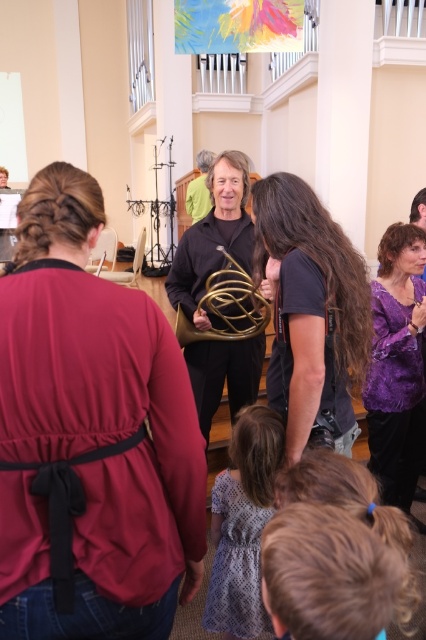
Based on the photo, who is shorter, matte red blouse at center or black t-shirt at center?

black t-shirt at center

The image size is (426, 640). Find the location of `matte red blouse at center`. matte red blouse at center is located at coordinates (91, 436).

Which is behind, point (72, 422) or point (290, 188)?

The point (290, 188) is behind.

Where is `matte red blouse at center`? The height and width of the screenshot is (640, 426). matte red blouse at center is located at coordinates (91, 436).

Is point (354, 426) positioned after point (250, 308)?

No.

Locate an element on the screen. The width and height of the screenshot is (426, 640). black t-shirt at center is located at coordinates (311, 310).

Is point (264, 200) closer to viewer compared to point (265, 316)?

Yes, it is in front of point (265, 316).

Where is `black t-shirt at center`? The width and height of the screenshot is (426, 640). black t-shirt at center is located at coordinates click(x=311, y=310).

Can you confirm if printed fabric dress at lower center is bigger than gold brass trumpet at center?

Correct, printed fabric dress at lower center is larger in size than gold brass trumpet at center.

Which is behind, point (210, 588) or point (224, 312)?

The point (224, 312) is more distant.

Is point (229, 605) positioned in front of point (210, 288)?

Yes, point (229, 605) is in front of point (210, 288).

You are a GUI agent. You are given a task and a screenshot of the screen. Output one action in this format:
    pyautogui.click(x=<x>, y=<y>)
    Task: Click on the printed fabric dress at lower center
    
    Given the screenshot: What is the action you would take?
    pyautogui.click(x=242, y=524)